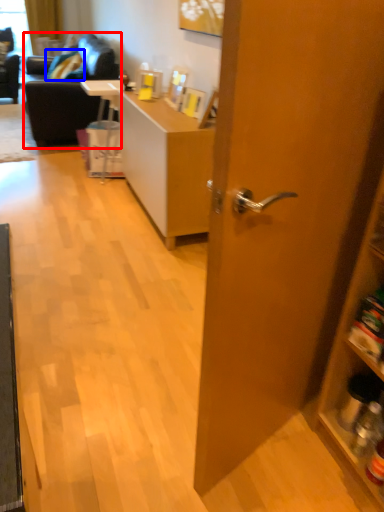
Question: Which of the following is the farthest to the observer, studio couch (highlighted by a red box) or pillow (highlighted by a blue box)?

Choices:
 (A) studio couch
 (B) pillow

Answer: (B)